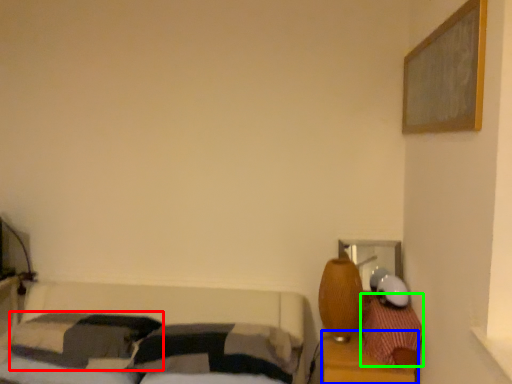
Question: Estimate the real-world distances between objects in this image. Which object is closer to pillow (highlighted by a red box), dresser (highlighted by a blue box) or pillow (highlighted by a green box)?

Choices:
 (A) dresser
 (B) pillow

Answer: (A)